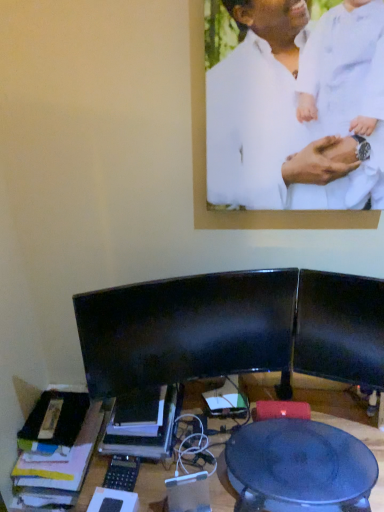
Question: Is point (142, 309) positioned closer to the camera than point (377, 202)?

Choices:
 (A) farther
 (B) closer

Answer: (B)

Question: From the image's perspective, is black glossy monitor at center above or below white matte shirt at upper center?

Choices:
 (A) above
 (B) below

Answer: (B)

Question: Estimate the real-world distances between objects in this image. Which object is closer to the white matte shirt at upper center?

Choices:
 (A) black glossy monitor at center
 (B) matte black table at center

Answer: (A)

Question: Which object is positioned farthest from the matte black table at center?

Choices:
 (A) black glossy monitor at center
 (B) white matte shirt at upper center

Answer: (B)